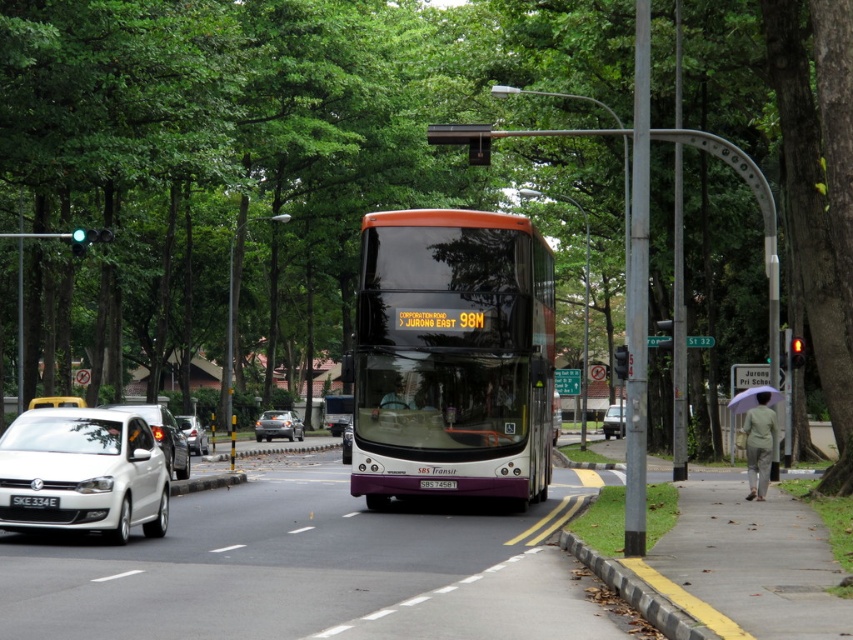
Is yellow rubber curb at lower center positioned at the back of white plastic license plate at center?

That is False.

Find the location of `yellow rubber curb at lower center`. yellow rubber curb at lower center is located at coordinates (636, 593).

Is point (770, 406) behind point (613, 420)?

No, (770, 406) is in front of (613, 420).

Can you confirm if purple fabric umbrella at lower right is thinner than white matte sedan at center?

In fact, purple fabric umbrella at lower right might be wider than white matte sedan at center.

Who is more distant from viewer, (734, 396) or (618, 420)?

Point (618, 420)

Where is `purple fabric umbrella at lower right`? The image size is (853, 640). purple fabric umbrella at lower right is located at coordinates (752, 397).

Can you confirm if white matte hatchback at lower left is positioned above white plastic license plate at center?

Correct, white matte hatchback at lower left is located above white plastic license plate at center.

Is point (90, 518) more distant than point (450, 483)?

No, (90, 518) is closer to viewer.

Image resolution: width=853 pixels, height=640 pixels. Identify the location of white matte hatchback at lower left. (83, 472).